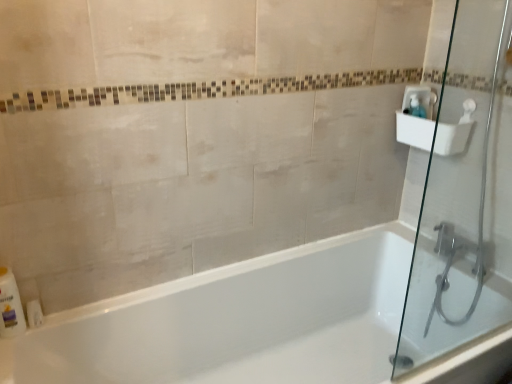
Question: Considering the relative sizes of white plastic sink at upper right and clear plastic soap dispenser at upper right in the image provided, is white plastic sink at upper right wider than clear plastic soap dispenser at upper right?

Choices:
 (A) no
 (B) yes

Answer: (B)

Question: From a real-world perspective, is white plastic sink at upper right under clear plastic soap dispenser at upper right?

Choices:
 (A) yes
 (B) no

Answer: (A)

Question: From the image's perspective, is white plastic sink at upper right located above clear plastic soap dispenser at upper right?

Choices:
 (A) no
 (B) yes

Answer: (A)

Question: Can clear plastic soap dispenser at upper right be found inside white plastic sink at upper right?

Choices:
 (A) yes
 (B) no

Answer: (A)

Question: Is white plastic sink at upper right positioned before clear plastic soap dispenser at upper right?

Choices:
 (A) yes
 (B) no

Answer: (A)

Question: In terms of width, does white plastic sink at upper right look wider or thinner when compared to white glossy bathtub at center?

Choices:
 (A) thin
 (B) wide

Answer: (A)

Question: Does point (425, 104) appear closer or farther from the camera than point (71, 324)?

Choices:
 (A) farther
 (B) closer

Answer: (A)

Question: Is white plastic sink at upper right inside the boundaries of white glossy bathtub at center, or outside?

Choices:
 (A) inside
 (B) outside

Answer: (B)

Question: Looking at the image, does white plastic sink at upper right seem bigger or smaller compared to white glossy bathtub at center?

Choices:
 (A) small
 (B) big

Answer: (A)

Question: Considering their positions, is white glossy bathtub at center located in front of or behind white plastic bottle at lower left?

Choices:
 (A) behind
 (B) front

Answer: (B)

Question: Considering the positions of white glossy bathtub at center and white plastic bottle at lower left in the image, is white glossy bathtub at center wider or thinner than white plastic bottle at lower left?

Choices:
 (A) thin
 (B) wide

Answer: (B)

Question: In terms of height, does white glossy bathtub at center look taller or shorter compared to white plastic bottle at lower left?

Choices:
 (A) short
 (B) tall

Answer: (B)

Question: Is white glossy bathtub at center to the left or to the right of white plastic bottle at lower left in the image?

Choices:
 (A) left
 (B) right

Answer: (B)

Question: Considering the relative positions of white plastic bottle at lower left and white glossy bathtub at center in the image provided, is white plastic bottle at lower left to the left or to the right of white glossy bathtub at center?

Choices:
 (A) right
 (B) left

Answer: (B)

Question: From the image's perspective, is white plastic bottle at lower left positioned above or below white glossy bathtub at center?

Choices:
 (A) below
 (B) above

Answer: (B)